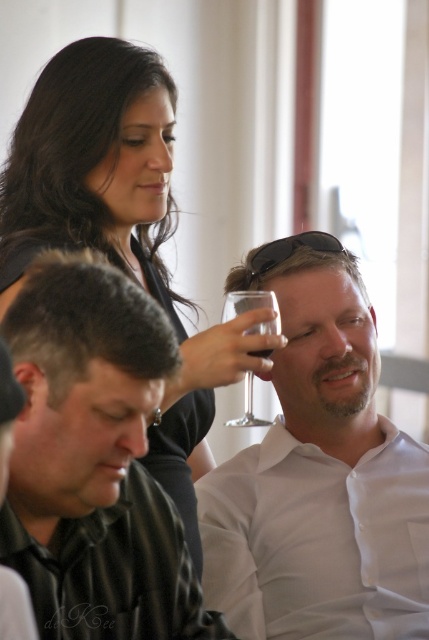
You are at a wine tasting event and want to approach the person wearing the black shirt at upper left to ask about the wine. Since the white glossy shirt at upper center is in your way, can you easily walk around them to reach the person?

The black shirt at upper left is behind the white glossy shirt at upper center, so you can easily walk around the white glossy shirt at upper center to reach the person wearing the black shirt at upper left.

You are organizing a photo shoot and need to place two shirts on a display rack. The rack has a limited width. Given the white glossy shirt at upper center and the black shirt at upper left, which shirt should you choose to ensure it fits on the rack if the rack can only accommodate the wider of the two?

The white glossy shirt at upper center might be wider than black shirt at upper left, so you should choose the white glossy shirt at upper center to ensure it fits on the rack since it is possibly the wider one.

You are at a wine tasting event and notice two people in the scene. Which person is wearing the white glossy shirt at upper center compared to the black shirt at lower left?

The white glossy shirt at upper center is located below the black shirt at lower left, so the person wearing the white glossy shirt at upper center is positioned lower than the one in the black shirt at lower left.